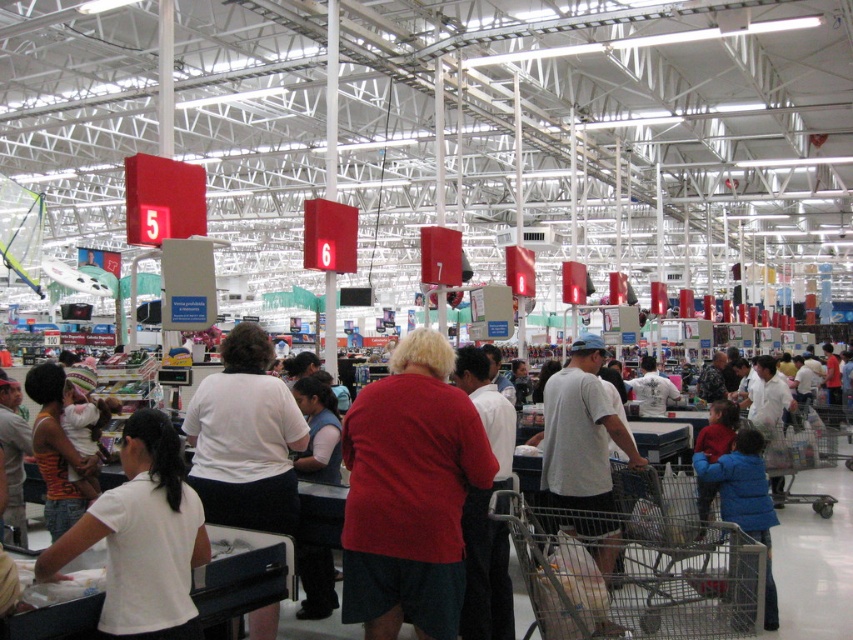
You are a store employee who needs to determine which customer has a wider shirt between the white cotton shirt at lower left and the matte red shirt at center. Which one should you inform the manager about?

The white cotton shirt at lower left has a larger width than the matte red shirt at center, so you should inform the manager about the white cotton shirt at lower left.